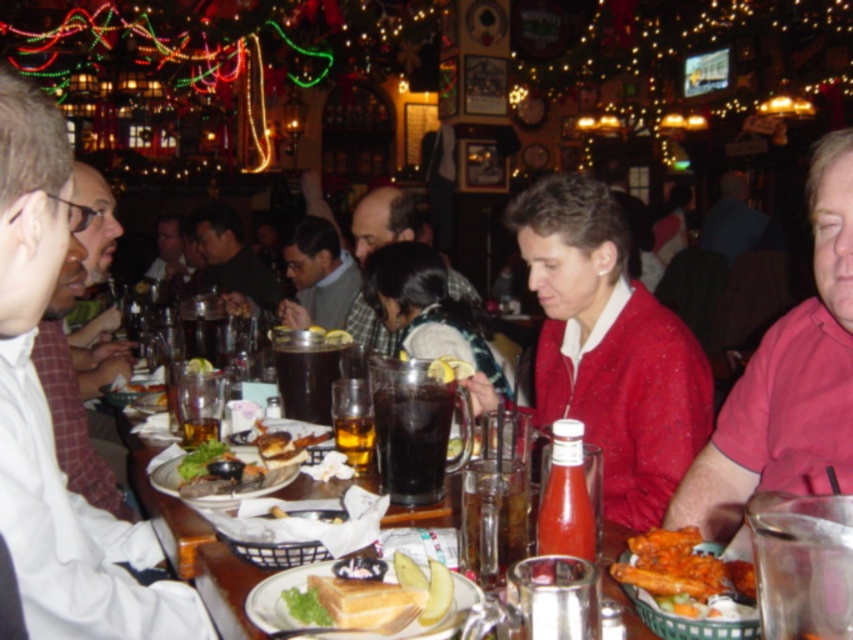
You are a customer at this festive restaurant and want to reach for both the dark brown liquid at center and the golden brown bread at center. Which one is closer to your right hand if you are sitting facing the table?

The dark brown liquid at center is to the right of golden brown bread at center, so it is closer to your right hand.

You are a customer sitting at the table in the foreground of the festive restaurant. You notice two points on the table where you could place your phone. One is at point [50,560] and the other is at point [164,221]. Which point is closer to you so that you can easily reach it without stretching?

Point [50,560] is closer to the viewer than point [164,221], so you should place your phone there for easier access.

You are a customer sitting at the table and want to hand a menu to the person wearing the white shirt at left and the smooth brown leather jacket at center. Which person is closer to you?

The smooth brown leather jacket at center is closer to you because the white shirt at left is taller than the smooth brown leather jacket at center, indicating that the jacket is positioned lower and thus nearer in the seating arrangement.